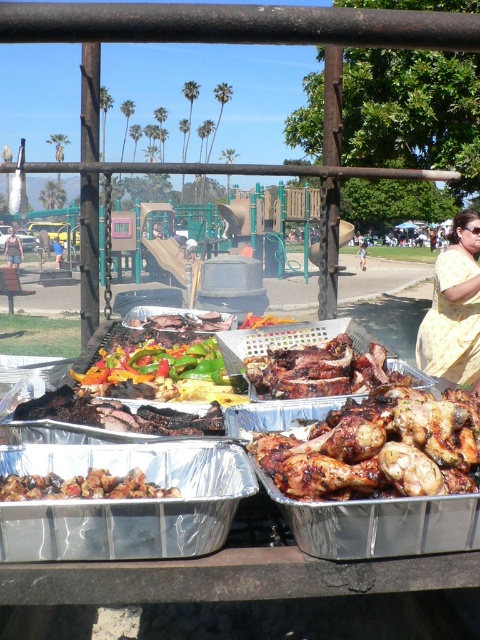
Question: Estimate the real-world distances between objects in this image. Which object is closer to the grilled meat at center?

Choices:
 (A) charred wood steak at center
 (B) brown matte ribs at center

Answer: (A)

Question: Does grilled meat at center come in front of charred wood steak at center?

Choices:
 (A) no
 (B) yes

Answer: (A)

Question: Among these points, which one is nearest to the camera?

Choices:
 (A) (263, 449)
 (B) (64, 408)
 (C) (466, 237)
 (D) (288, 384)

Answer: (A)

Question: Among these points, which one is farthest from the camera?

Choices:
 (A) (128, 486)
 (B) (268, 396)

Answer: (B)

Question: Does yellow fabric dress at right have a greater width compared to charred wood steak at center?

Choices:
 (A) no
 (B) yes

Answer: (A)

Question: Can you confirm if grilled meat at center is smaller than vibrant green bell peppers at center?

Choices:
 (A) yes
 (B) no

Answer: (A)